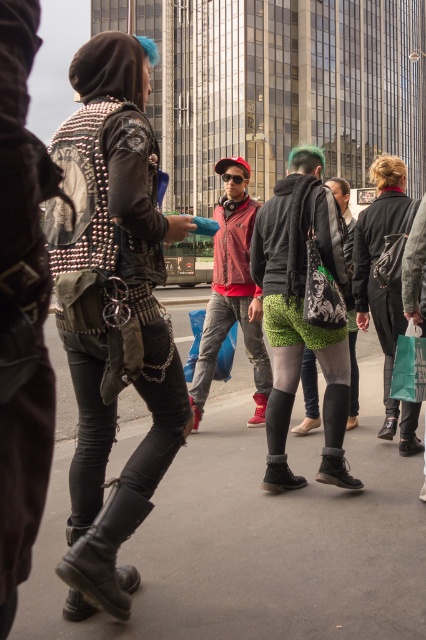
Question: Which of the following is the closest to the observer?

Choices:
 (A) green matte shopping bag at lower right
 (B) gray asphalt pavement at center
 (C) blue plastic bag at center
 (D) black leather boot at lower left

Answer: (D)

Question: Is gray asphalt pavement at center smaller than blue plastic bag at center?

Choices:
 (A) yes
 (B) no

Answer: (A)

Question: Which object is the closest to the red fabric jacket at center?

Choices:
 (A) green matte shopping bag at lower right
 (B) black leather boot at lower left
 (C) studded leather jacket at left

Answer: (B)

Question: Can you confirm if black leather boot at lower left is positioned to the left of blue plastic bag at center?

Choices:
 (A) yes
 (B) no

Answer: (A)

Question: Is the position of gray asphalt pavement at center less distant than that of green textured skirt at center?

Choices:
 (A) yes
 (B) no

Answer: (A)

Question: Based on their relative distances, which object is nearer to the studded leather jacket at left?

Choices:
 (A) green textured shorts at center
 (B) blue plastic bag at center
 (C) gray asphalt pavement at center

Answer: (C)